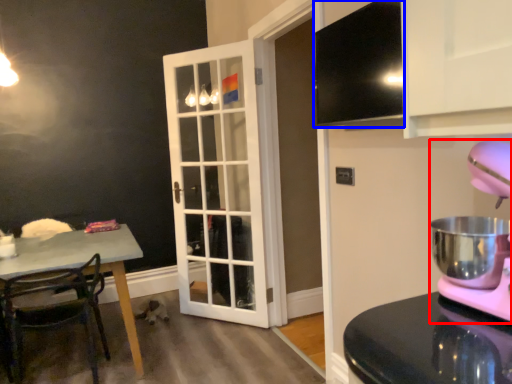
Question: Which of the following is the closest to the observer, mixer (highlighted by a red box) or exhaust hood (highlighted by a blue box)?

Choices:
 (A) mixer
 (B) exhaust hood

Answer: (A)